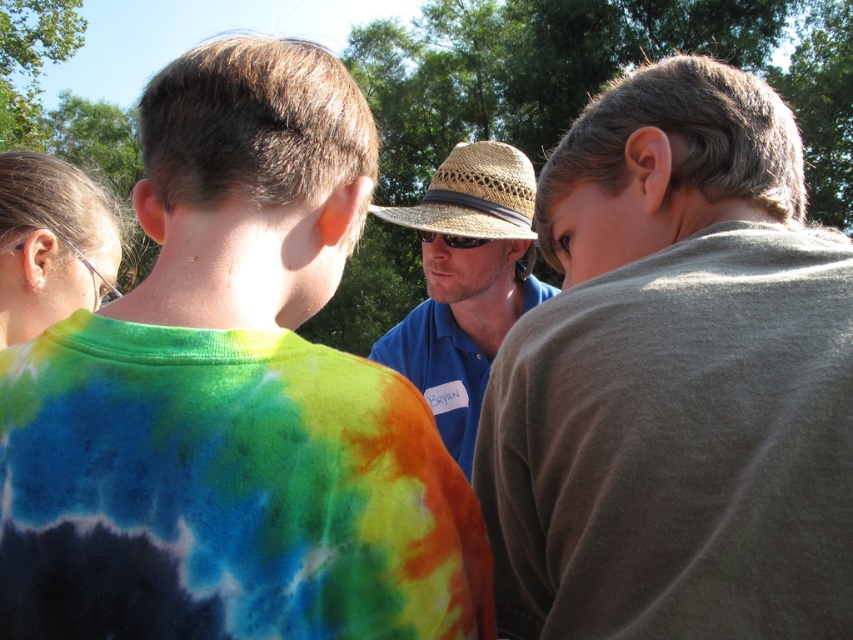
Is point (367, 141) positioned in front of point (13, 314)?

Yes, point (367, 141) is in front of point (13, 314).

Which is below, tie-dye fabric shirt at center or clear plastic glasses at left?

tie-dye fabric shirt at center is below.

This screenshot has height=640, width=853. Describe the element at coordinates (233, 397) in the screenshot. I see `tie-dye fabric shirt at center` at that location.

This screenshot has width=853, height=640. I want to click on tie-dye fabric shirt at center, so click(x=233, y=397).

Which is below, blue shirt at center or straw hat at center?

blue shirt at center is lower down.

Can you confirm if blue shirt at center is taller than straw hat at center?

No, blue shirt at center is not taller than straw hat at center.

The height and width of the screenshot is (640, 853). I want to click on blue shirt at center, so click(x=675, y=380).

Can you confirm if straw hat at center is positioned below clear plastic glasses at left?

Correct, straw hat at center is located below clear plastic glasses at left.

Between straw hat at center and clear plastic glasses at left, which one appears on the right side from the viewer's perspective?

Positioned to the right is straw hat at center.

This screenshot has width=853, height=640. Identify the location of straw hat at center. (465, 284).